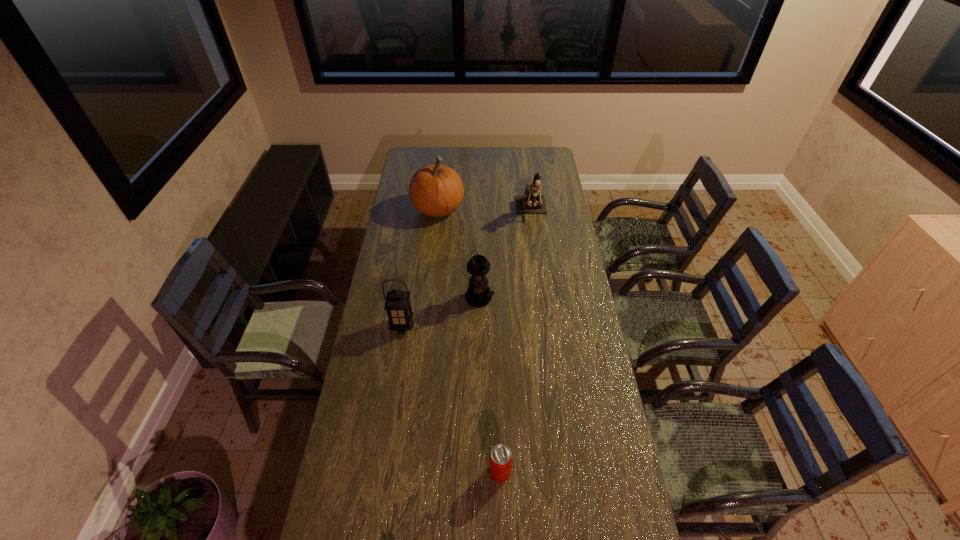
This screenshot has width=960, height=540. I want to click on free space between the third farthest object and the left lantern, so click(441, 312).

Where is `vacant space that is in between the figurine and the can`? The width and height of the screenshot is (960, 540). vacant space that is in between the figurine and the can is located at coordinates [x=516, y=341].

What are the coordinates of `vacant area that lies between the pumpkin and the third farthest object` in the screenshot? It's located at (459, 253).

At what (x,y) coordinates should I click in order to perform the action: click on free spot between the pumpkin and the nearer lantern. Please return your answer as a coordinate pair (x, y). Image resolution: width=960 pixels, height=540 pixels. Looking at the image, I should click on [420, 267].

Find the location of a particular element. This screenshot has height=540, width=960. object that is the closest to the farther lantern is located at coordinates (397, 304).

Select which object is the closest to the nearer lantern. Please provide its 2D coordinates. Your answer should be formatted as a tuple, i.e. [(x, y)], where the tuple contains the x and y coordinates of a point satisfying the conditions above.

[(478, 294)]

Identify the location of vacant space that satisfies the following two spatial constraints: 1. on the back side of the shortest object; 2. above the third farthest object, indicating its light source. The width and height of the screenshot is (960, 540). (494, 298).

This screenshot has height=540, width=960. I want to click on free space that satisfies the following two spatial constraints: 1. above the nearest object, indicating its light source; 2. on the right side of the third nearest object, so click(480, 472).

In order to click on blank area in the image that satisfies the following two spatial constraints: 1. on the stem of the can; 2. on the left side of the pumpkin in this screenshot , I will do `click(410, 472)`.

Locate an element on the screen. vacant space that satisfies the following two spatial constraints: 1. on the stem of the pumpkin; 2. on the left side of the nearest object is located at coordinates (410, 472).